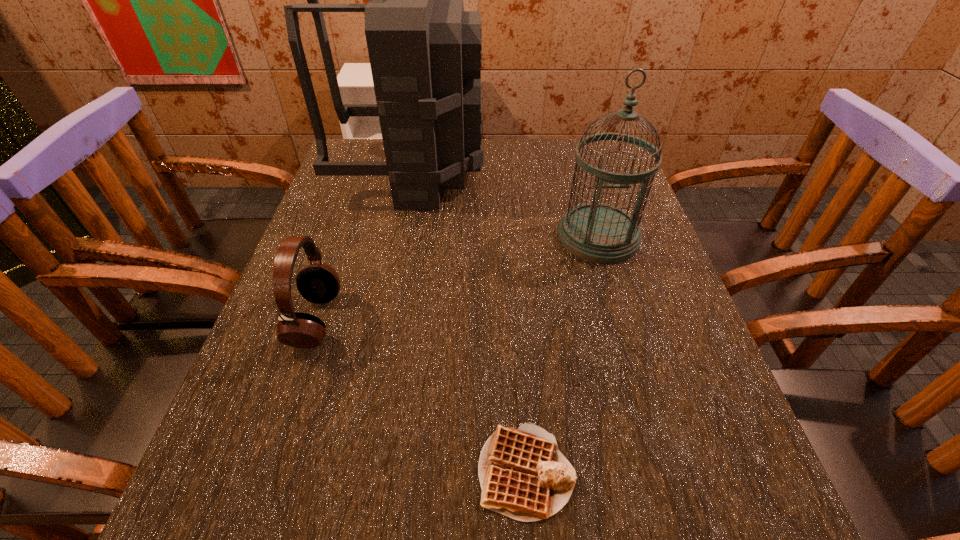
Where is `backpack`? The width and height of the screenshot is (960, 540). backpack is located at coordinates (425, 51).

Where is `the rightmost object`? This screenshot has width=960, height=540. the rightmost object is located at coordinates (597, 232).

Locate an element on the screen. birdcage is located at coordinates (597, 232).

In order to click on the third tallest object in this screenshot , I will do `click(319, 283)`.

At what (x,y) coordinates should I click in order to perform the action: click on headset. Please return your answer as a coordinate pair (x, y). This screenshot has height=540, width=960. Looking at the image, I should click on (319, 283).

Find the location of a particular element. Image resolution: width=960 pixels, height=540 pixels. waffle is located at coordinates (523, 475).

Where is `the shortest object`? the shortest object is located at coordinates (523, 475).

Find the location of a particular element. free space located 0.180m on the front compartment of the backpack is located at coordinates pos(548,173).

Locate an element on the screen. The image size is (960, 540). vacant area situated 0.130m on the front-facing side of the birdcage is located at coordinates (620, 309).

This screenshot has width=960, height=540. I want to click on blank space located on the ear pads of the headset, so (x=379, y=320).